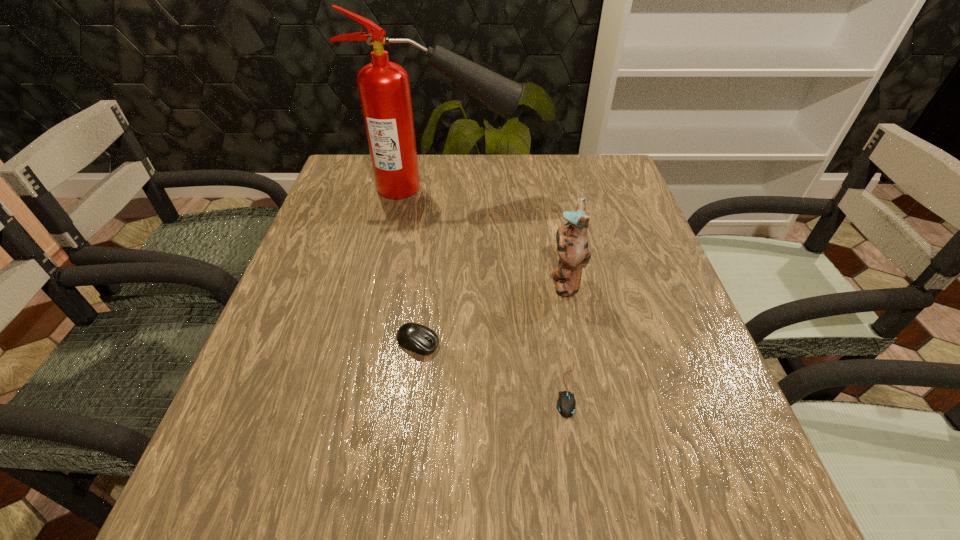
Locate an element on the screen. The image size is (960, 540). vacant space located 0.110m on the front-facing side of the figurine is located at coordinates (498, 281).

You are a GUI agent. You are given a task and a screenshot of the screen. Output one action in this format:
    pyautogui.click(x=<x>, y=<y>)
    Task: Click on the vacant area situated 0.130m on the front-facing side of the figurine
    
    Given the screenshot: What is the action you would take?
    pyautogui.click(x=490, y=281)

Where is `free region located 0.060m on the left of the taller mouse`? The image size is (960, 540). free region located 0.060m on the left of the taller mouse is located at coordinates tap(365, 343).

You are a GUI agent. You are given a task and a screenshot of the screen. Output one action in this format:
    pyautogui.click(x=<x>, y=<y>)
    Task: Click on the free space located on the front of the nearer mouse
    The height and width of the screenshot is (540, 960).
    Given the screenshot: What is the action you would take?
    pyautogui.click(x=577, y=455)

The image size is (960, 540). In order to click on object that is positioned at the far edge in this screenshot , I will do `click(384, 89)`.

Where is `object at the left edge`? This screenshot has width=960, height=540. object at the left edge is located at coordinates (384, 89).

This screenshot has height=540, width=960. I want to click on object that is at the far left corner, so click(x=384, y=89).

Image resolution: width=960 pixels, height=540 pixels. In order to click on free space at the far edge in this screenshot , I will do `click(522, 161)`.

Locate an element on the screen. free space at the near edge of the desktop is located at coordinates (483, 494).

At what (x,y) coordinates should I click in order to perform the action: click on vacant space at the left edge of the desktop. Please return your answer as a coordinate pair (x, y). This screenshot has height=540, width=960. Looking at the image, I should click on (313, 418).